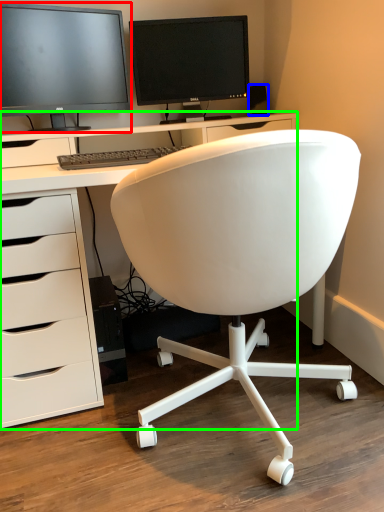
Question: Which object is the farthest from computer monitor (highlighted by a red box)? Choose among these: office supplies (highlighted by a blue box) or desk (highlighted by a green box).

Choices:
 (A) office supplies
 (B) desk

Answer: (A)